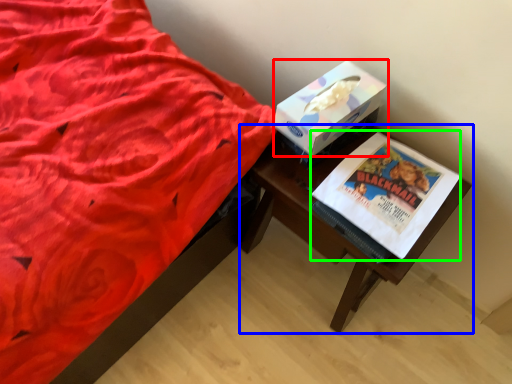
Question: Which is farther away from box (highlighted by a red box)? table (highlighted by a blue box) or paperback book (highlighted by a green box)?

Choices:
 (A) table
 (B) paperback book

Answer: (A)